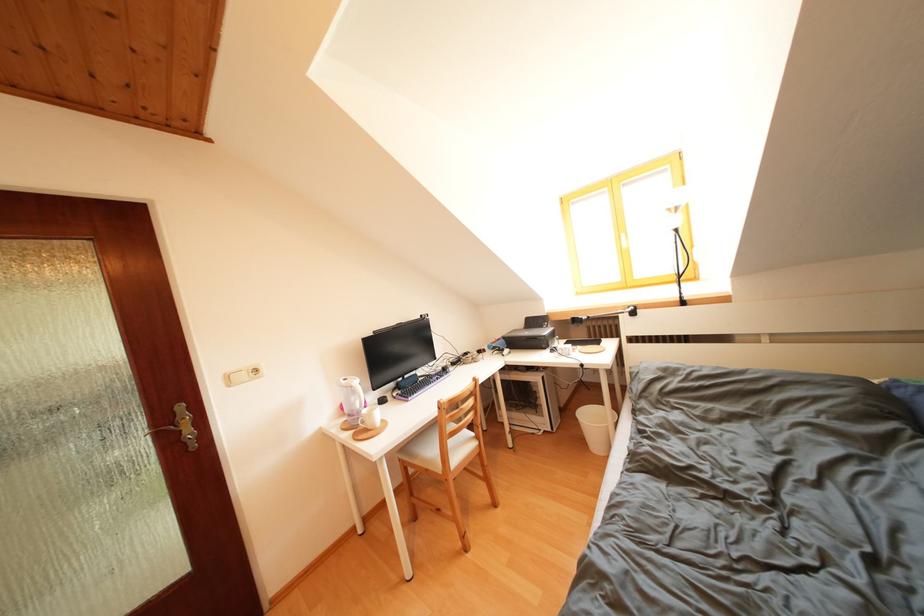
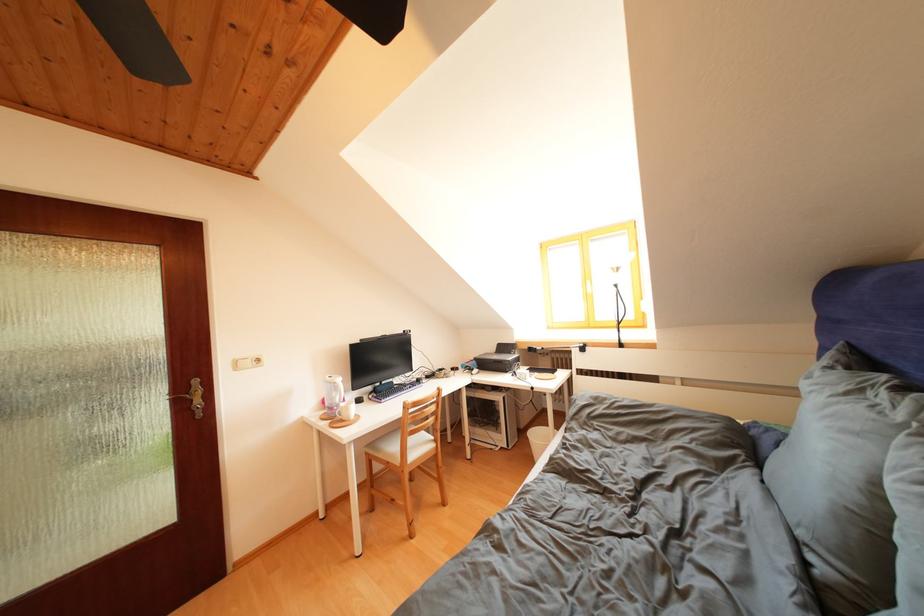
Find the pixel in the second image that matches pixel 360 403 in the first image.

(342, 399)